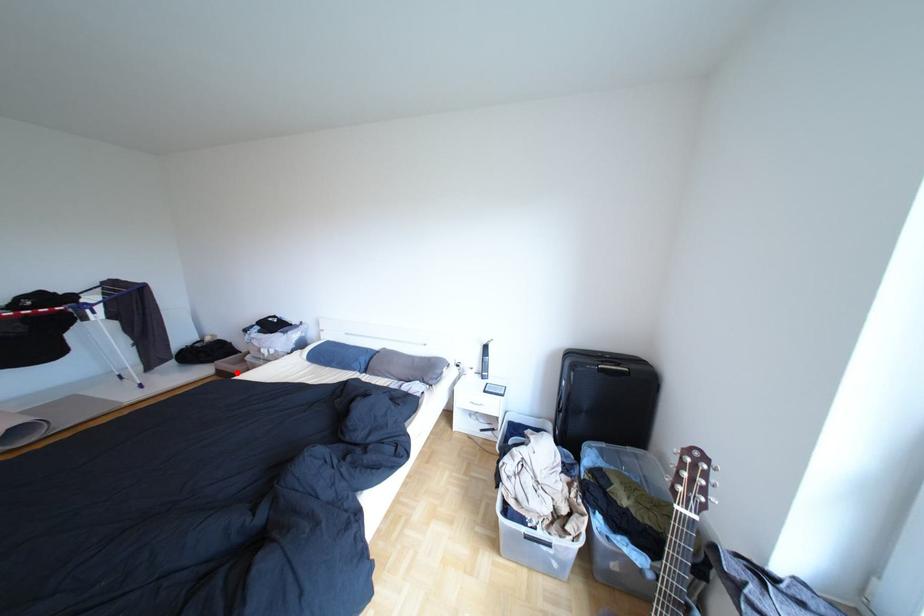
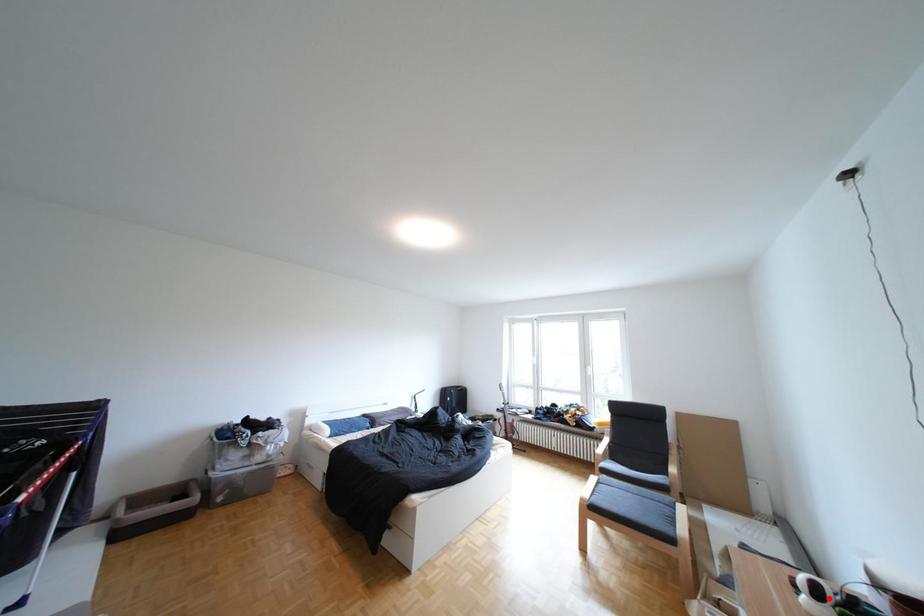
I am providing you with two images of the same scene from different viewpoints. A red point is marked on the first image and another point is marked on the second image. Is the marked point in image1 the same physical position as the marked point in image2?

No